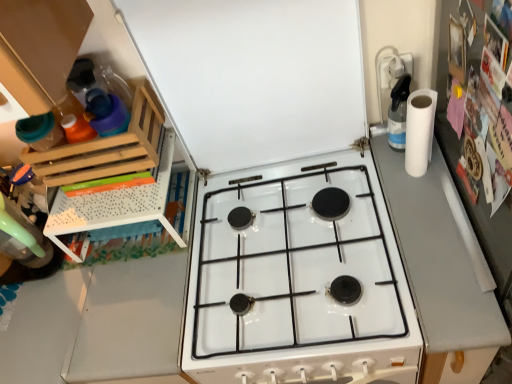
Identify the location of vacant space situated above gray matte counter top at right (from a real-world perspective). tap(432, 231).